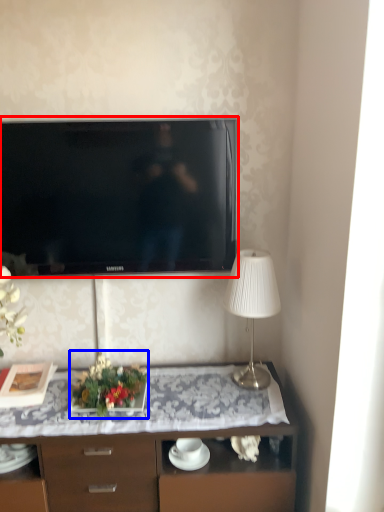
Question: Which point is closer to the camera, television (highlighted by a red box) or floral arrangement (highlighted by a blue box)?

Choices:
 (A) television
 (B) floral arrangement

Answer: (B)